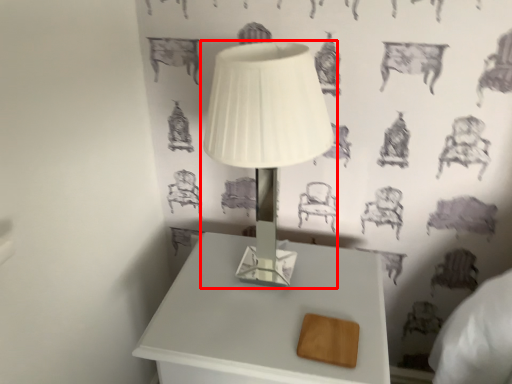
Question: From the image's perspective, where is lamp (annotated by the red box) located in relation to table in the image?

Choices:
 (A) below
 (B) above

Answer: (B)